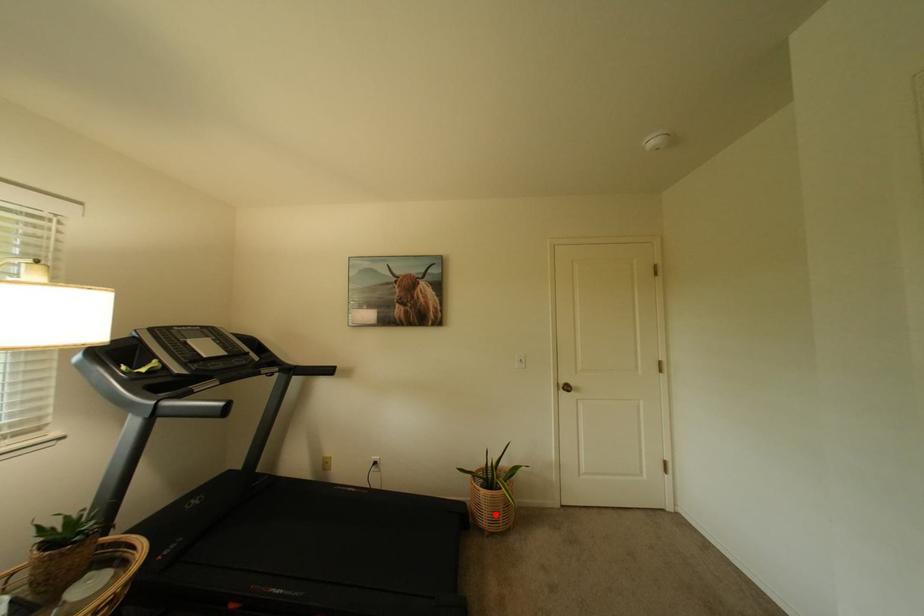
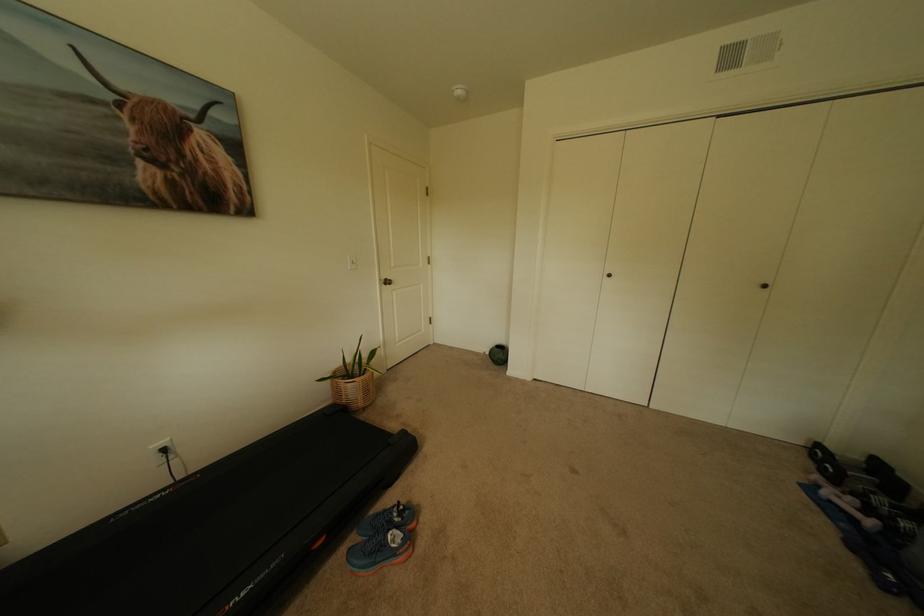
In the second image, find the point that corresponds to the highlighted location in the first image.

(370, 395)